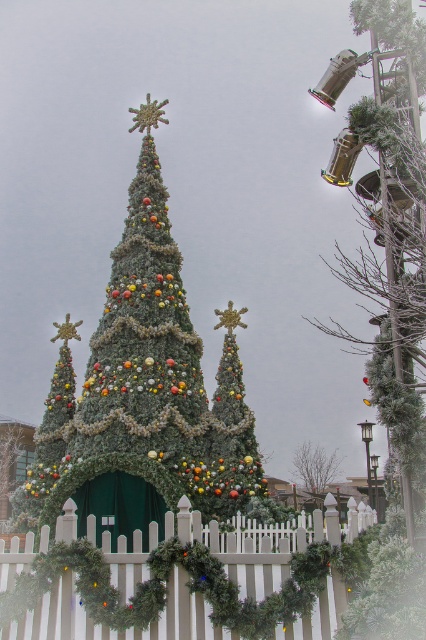
Question: Which point is farther from the camera taking this photo?

Choices:
 (A) (325, 464)
 (B) (109, 627)
 (C) (379, 160)

Answer: (A)

Question: Can you confirm if green textured christmas tree at center is positioned to the right of white picket fence at center?

Choices:
 (A) yes
 (B) no

Answer: (B)

Question: Where is white picket fence at center located in relation to frosted greenery at upper right in the image?

Choices:
 (A) right
 (B) left

Answer: (B)

Question: Which object appears farthest from the camera in this image?

Choices:
 (A) green matte christmas tree at center
 (B) frosted greenery at upper right

Answer: (A)

Question: Which of the following is the closest to the observer?

Choices:
 (A) frosted greenery at upper right
 (B) white picket fence at center

Answer: (A)

Question: Observing the image, what is the correct spatial positioning of green textured christmas tree at center in reference to frosted greenery at upper right?

Choices:
 (A) above
 (B) below

Answer: (A)